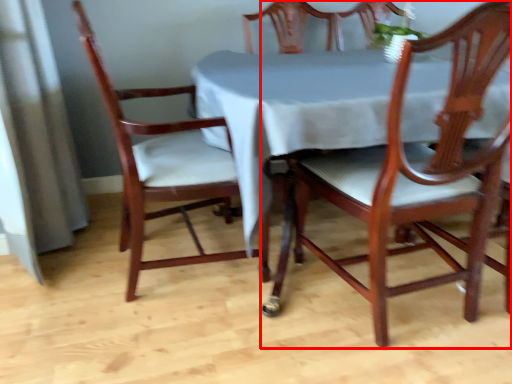
Question: From the image's perspective, where is chair (annotated by the red box) located in relation to chair in the image?

Choices:
 (A) below
 (B) above

Answer: (A)